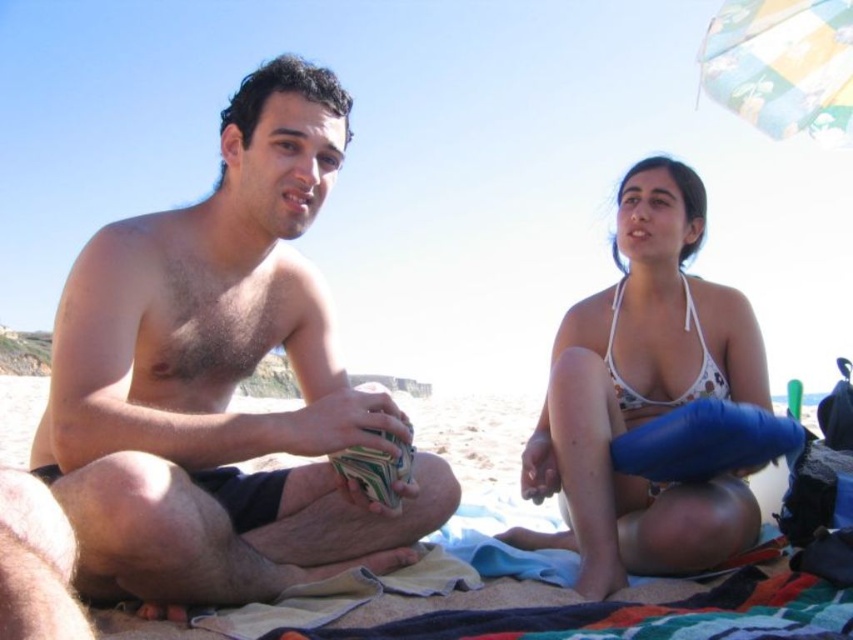
You are a photographer standing at the beach. You want to take a photo that includes both the hairless skin at center and the multicolored fabric umbrella at upper right. Given that your camera has a maximum focus range of 30 meters, will you be able to capture both objects in focus at the same time?

The hairless skin at center and multicolored fabric umbrella at upper right are 35.75 meters apart from each other. Since the distance exceeds the camera maximum focus range of 30 meters, you cannot capture both objects in focus simultaneously.

Based on the scene description, which object has a greater width when comparing the hairless skin at center and the white bikini top at center?

The hairless skin at center has a greater width than the white bikini top at center.

You are a photographer trying to capture the scene from the current viewpoint. You want to ensure that both the hairless skin at center and the multicolored fabric umbrella at upper right are in focus. Which object should you focus on first to ensure proper depth of field?

You should focus on the hairless skin at center first because it is closer to the viewer than the multicolored fabric umbrella at upper right, allowing the depth of field to extend backward to include the umbrella.